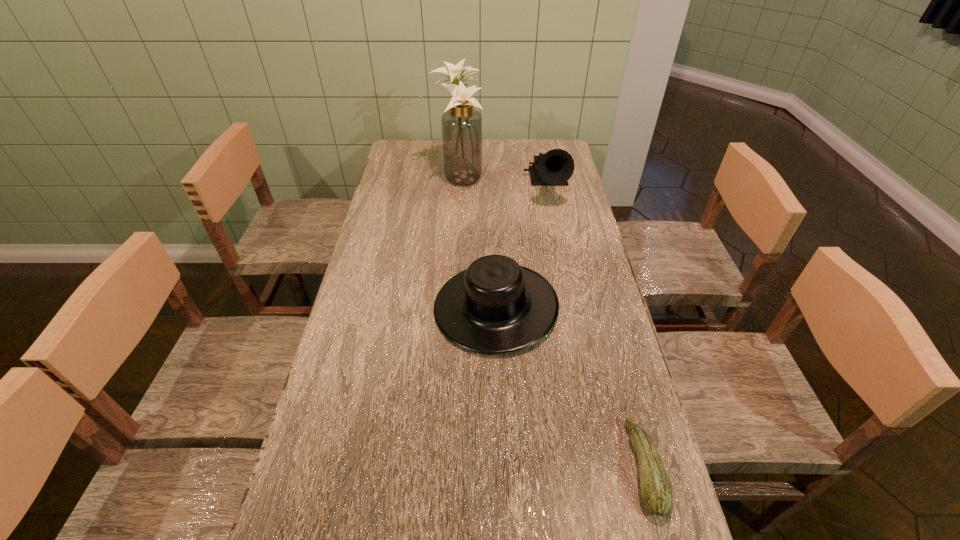
Where is `free space between the nearest object and the second tallest object`? Image resolution: width=960 pixels, height=540 pixels. free space between the nearest object and the second tallest object is located at coordinates pyautogui.click(x=596, y=327).

Where is `empty space between the third farthest object and the flower arrangement`? empty space between the third farthest object and the flower arrangement is located at coordinates (477, 242).

Locate an element on the screen. The height and width of the screenshot is (540, 960). vacant area that lies between the phonograph_record and the tallest object is located at coordinates (503, 183).

Find the location of a particular element. This screenshot has height=540, width=960. free space between the dress hat and the zucchini is located at coordinates (570, 387).

The image size is (960, 540). What are the coordinates of `free space between the dress hat and the phonograph_record` in the screenshot? It's located at (521, 247).

Select which object is the second closest to the nearest object. Please provide its 2D coordinates. Your answer should be formatted as a tuple, i.e. [(x, y)], where the tuple contains the x and y coordinates of a point satisfying the conditions above.

[(554, 168)]

The height and width of the screenshot is (540, 960). What are the coordinates of `the closest object relative to the second tallest object` in the screenshot? It's located at (461, 124).